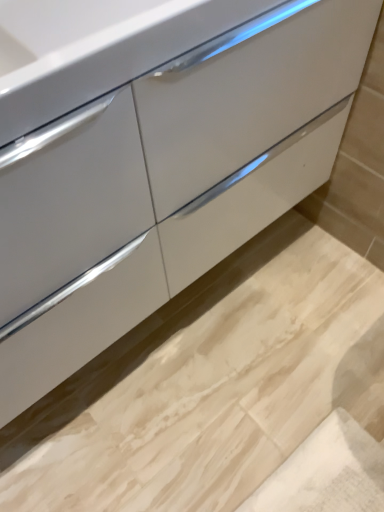
Image resolution: width=384 pixels, height=512 pixels. Describe the element at coordinates (248, 97) in the screenshot. I see `white glossy drawer at center` at that location.

The width and height of the screenshot is (384, 512). I want to click on white glossy drawer at center, so click(x=248, y=97).

Identify the location of white glossy drawer at center. (248, 97).